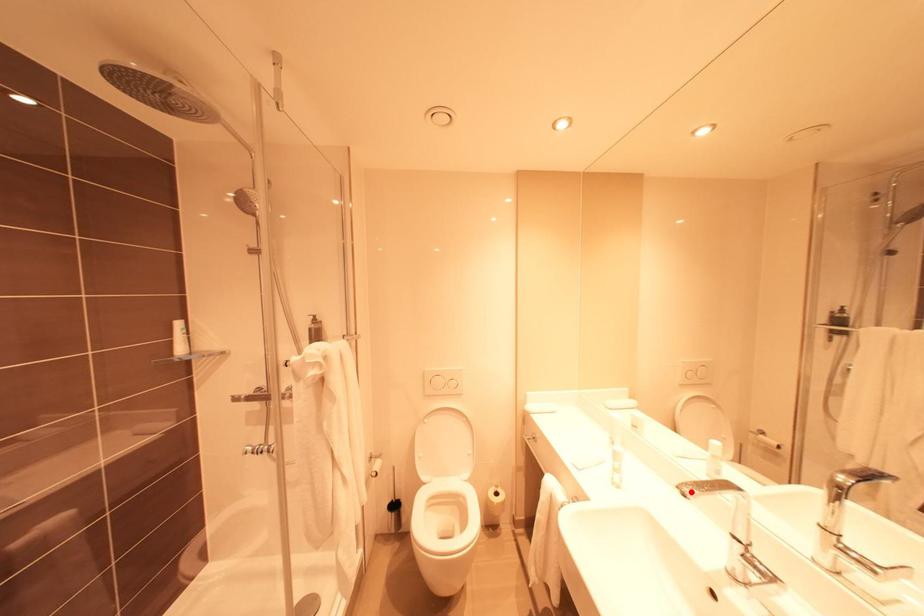
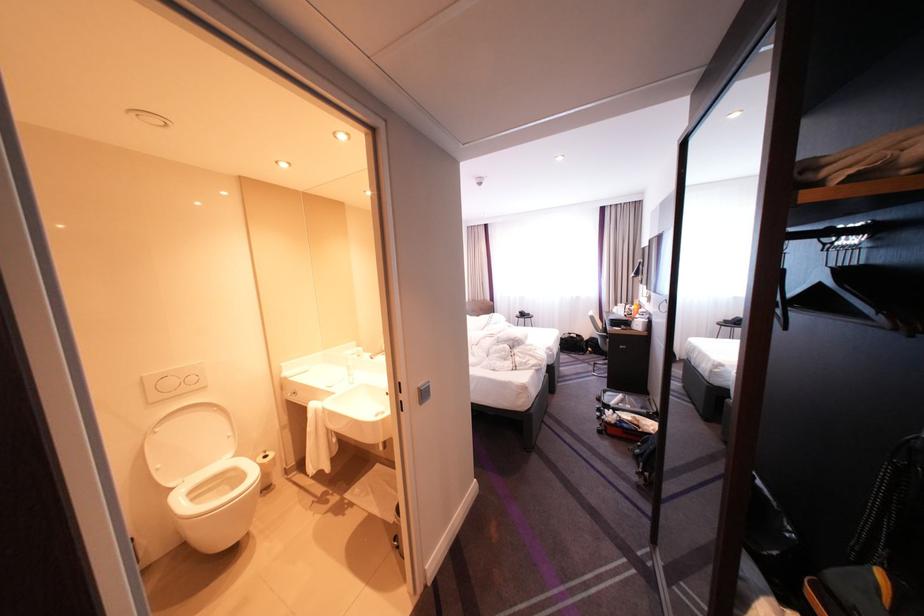
Question: A red point is marked in image1. In image2, is the corresponding 3D point closer to the camera or farther? Reply with the corresponding letter.

Choices:
 (A) The corresponding 3D point is closer.
 (B) The corresponding 3D point is farther.

Answer: (B)